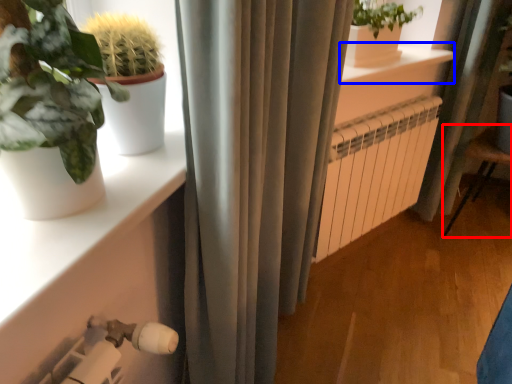
Question: Among these objects, which one is nearest to the camera, armchair (highlighted by a red box) or window sill (highlighted by a blue box)?

Choices:
 (A) armchair
 (B) window sill

Answer: (B)